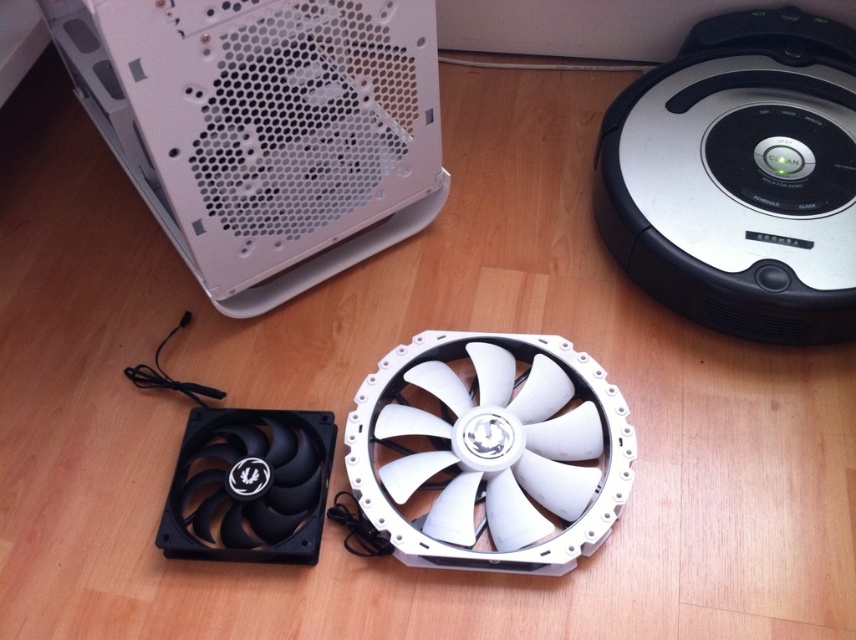
Between point (617, 488) and point (296, 422), which one is positioned in front?

Point (617, 488) is in front.

Locate an element on the screen. Image resolution: width=856 pixels, height=640 pixels. white plastic fan at center is located at coordinates (494, 452).

The width and height of the screenshot is (856, 640). Identify the location of white plastic fan at center. (494, 452).

Is point (286, 266) farther from camera compared to point (251, 508)?

That is True.

Who is lower down, white matte computer case at upper left or black plastic fan at lower left?

black plastic fan at lower left is below.

The image size is (856, 640). I want to click on white matte computer case at upper left, so click(265, 129).

Which is above, white matte computer case at upper left or white plastic fan at center?

white matte computer case at upper left is above.

Which of these two, white matte computer case at upper left or white plastic fan at center, stands shorter?

white plastic fan at center is shorter.

Is point (284, 22) farther from camera compared to point (538, 406)?

No, it is in front of (538, 406).

Image resolution: width=856 pixels, height=640 pixels. Find the location of `white matte computer case at upper left`. white matte computer case at upper left is located at coordinates (265, 129).